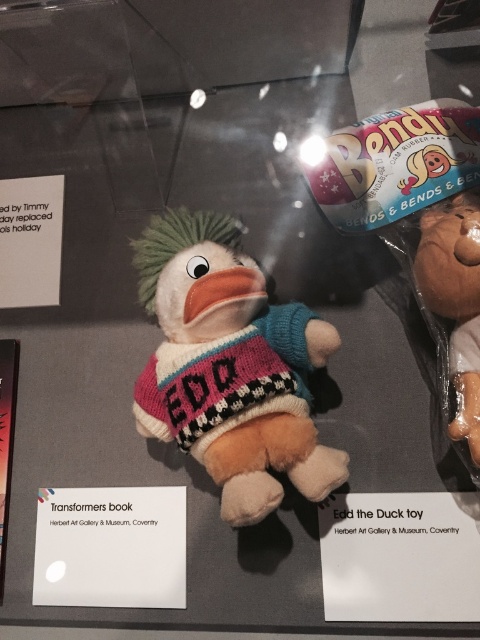
Is fluffy multicolored duck at center positioned at the back of matte brown plush toy at right?

No.

Can you confirm if fluffy multicolored duck at center is bigger than matte brown plush toy at right?

Indeed, fluffy multicolored duck at center has a larger size compared to matte brown plush toy at right.

Does point (168, 289) come behind point (456, 426)?

Yes, point (168, 289) is behind point (456, 426).

Identify the location of fluffy multicolored duck at center. (229, 365).